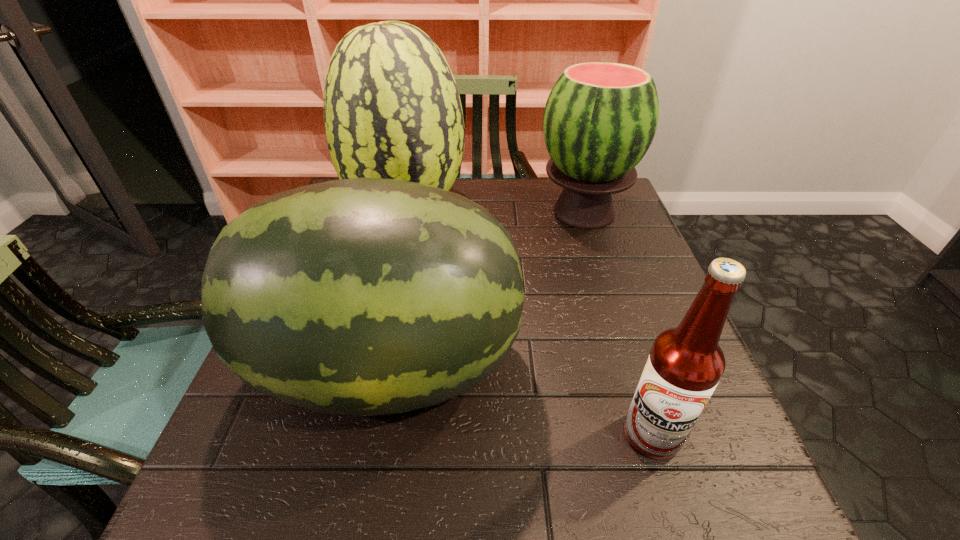
Find the location of a particular element. object at the far left corner is located at coordinates (392, 110).

Where is `object that is at the far right corner`? This screenshot has height=540, width=960. object that is at the far right corner is located at coordinates (600, 118).

Image resolution: width=960 pixels, height=540 pixels. In order to click on vacant space at the far edge of the desktop in this screenshot , I will do `click(541, 209)`.

Identify the location of vacant space at the near edge of the desktop. (344, 531).

The image size is (960, 540). Identify the location of vacant space at the left edge of the desktop. (282, 468).

In the image, there is a desktop. Where is `vacant space at the right edge`? The image size is (960, 540). vacant space at the right edge is located at coordinates (629, 287).

This screenshot has width=960, height=540. In order to click on free space at the near left corner in this screenshot , I will do `click(224, 508)`.

Where is `free spot at the far right corner of the desktop`? free spot at the far right corner of the desktop is located at coordinates (622, 194).

The image size is (960, 540). What are the coordinates of `free space between the tallest object and the rightmost watermelon` in the screenshot? It's located at (494, 211).

This screenshot has width=960, height=540. In order to click on free space that is in between the alcohol and the rightmost watermelon in this screenshot , I will do `click(617, 323)`.